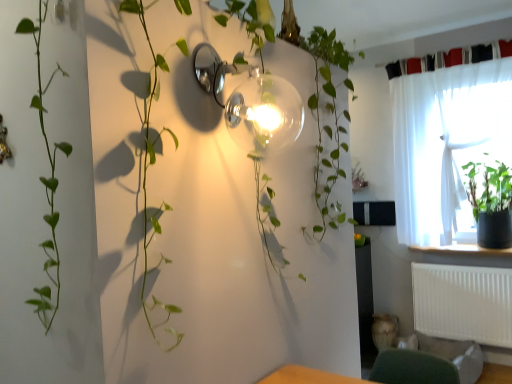
Locate an element on the screen. This screenshot has height=384, width=512. empty space that is ontop of white plastic radiator at lower right (from a real-world perspective) is located at coordinates (461, 260).